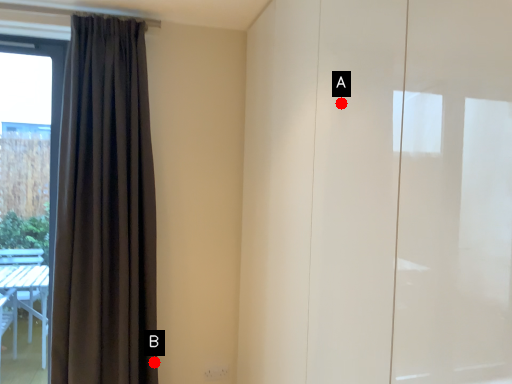
Question: Two points are circled on the image, labeled by A and B beside each circle. Which point is farther from the camera taking this photo?

Choices:
 (A) A is further
 (B) B is further

Answer: (B)